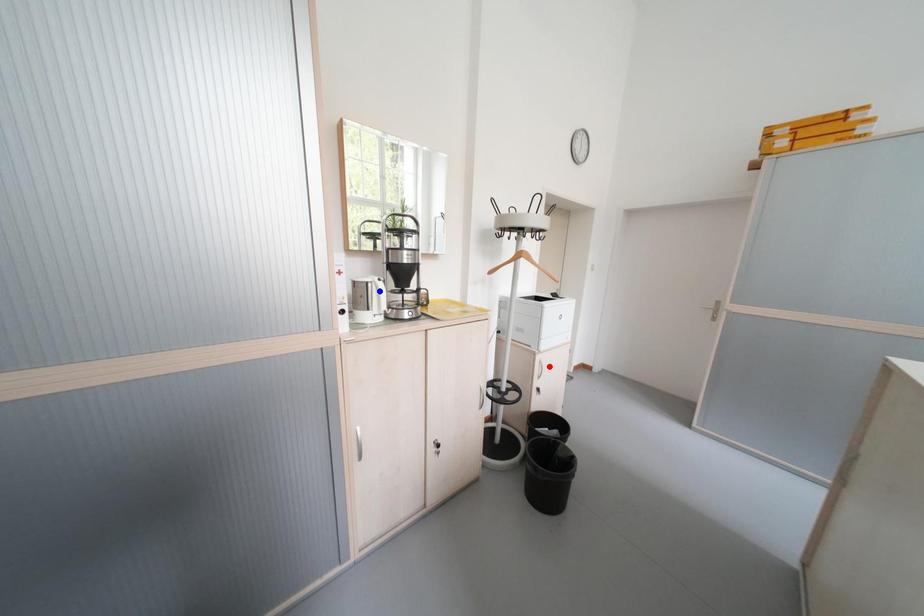
Question: Two points are marked on the image. Which point is closer to the camera?

Choices:
 (A) Blue point is closer.
 (B) Red point is closer.

Answer: (A)